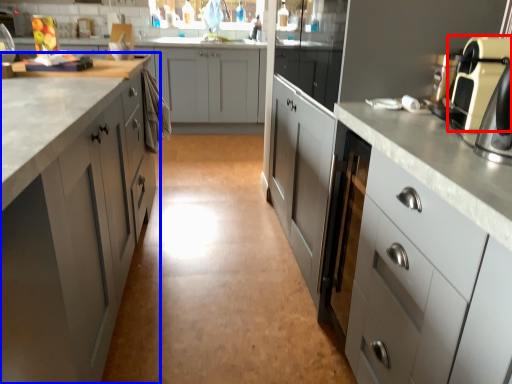
Question: Which point is further to the camera, home appliance (highlighted by a red box) or cabinetry (highlighted by a blue box)?

Choices:
 (A) home appliance
 (B) cabinetry

Answer: (A)